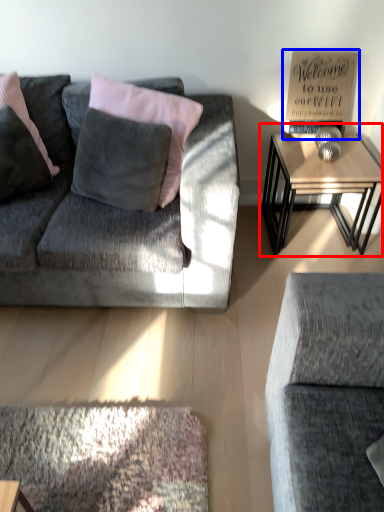
Question: Which of the following is the farthest to the observer, table (highlighted by a red box) or bulletin board (highlighted by a blue box)?

Choices:
 (A) table
 (B) bulletin board

Answer: (B)